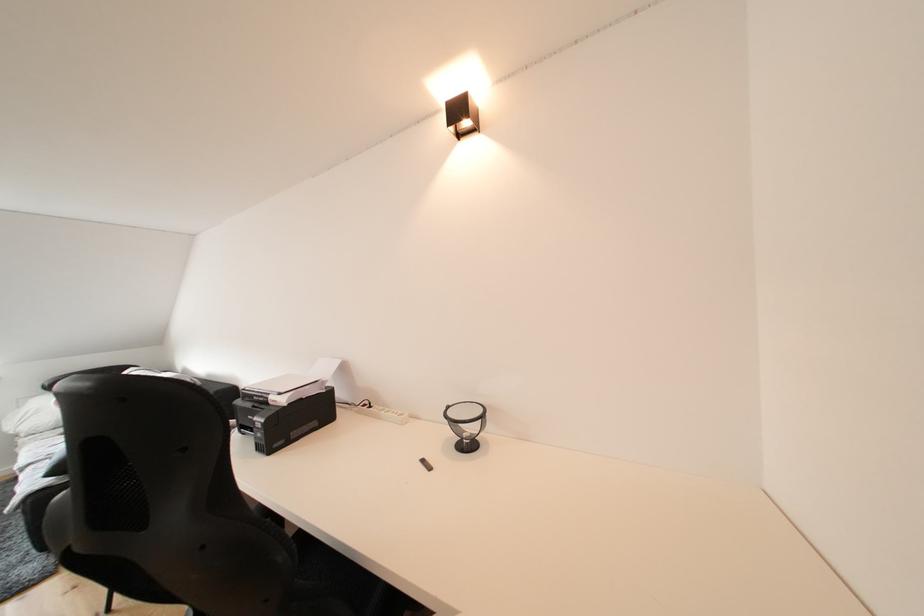
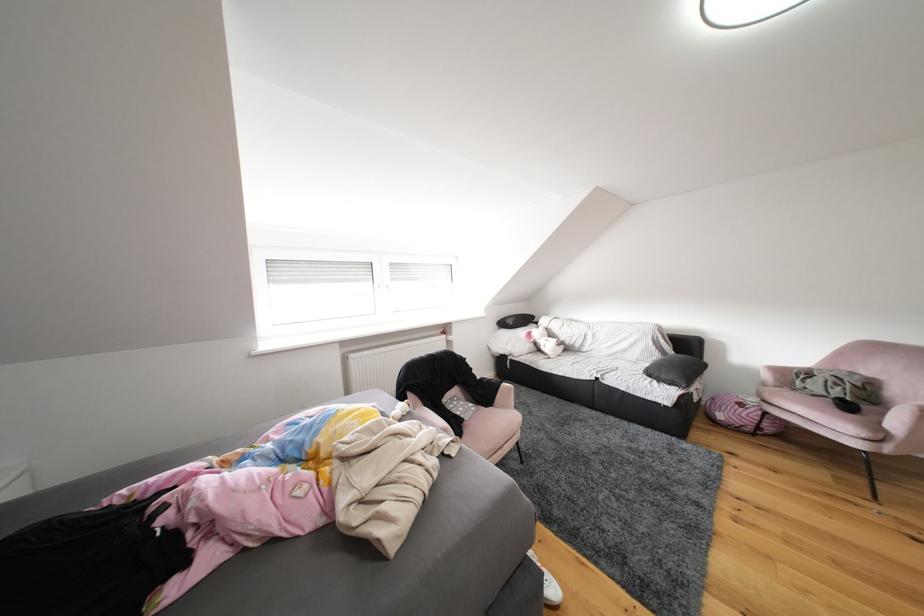
Question: What movement of the cameraman would produce the second image?

Choices:
 (A) Left
 (B) Right
 (C) Forward
 (D) Backward

Answer: (A)